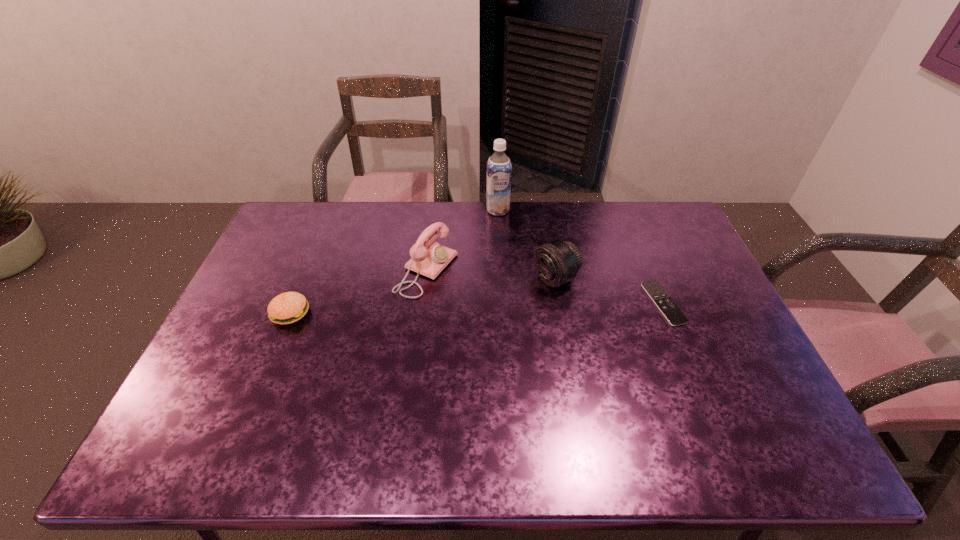
Find the location of a particular element. The image size is (960, 540). free point that satisfies the following two spatial constraints: 1. on the back side of the fourth object from right to left; 2. on the left side of the patty is located at coordinates (308, 270).

Where is `free space that satisfies the following two spatial constraints: 1. on the back side of the farthest object; 2. on the left side of the telephone`? This screenshot has width=960, height=540. free space that satisfies the following two spatial constraints: 1. on the back side of the farthest object; 2. on the left side of the telephone is located at coordinates (435, 210).

Image resolution: width=960 pixels, height=540 pixels. What are the coordinates of `free space that satisfies the following two spatial constraints: 1. on the front side of the rightmost object; 2. on the left side of the telephone` in the screenshot? It's located at (422, 303).